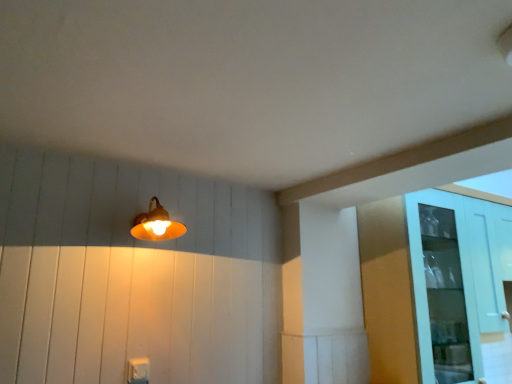
In order to face light blue glass cabinet at right, should I rotate leftwards or rightwards?

Turn right by 30.168 degrees to look at light blue glass cabinet at right.

What do you see at coordinates (443, 289) in the screenshot? The height and width of the screenshot is (384, 512). I see `light blue glass cabinet at right` at bounding box center [443, 289].

You are a GUI agent. You are given a task and a screenshot of the screen. Output one action in this format:
    pyautogui.click(x=<x>, y=<y>)
    Task: Click on the light blue glass cabinet at right
    
    Given the screenshot: What is the action you would take?
    pyautogui.click(x=443, y=289)

What is the approximate width of matte orange lampshade at upper left?

The width of matte orange lampshade at upper left is 26.81 centimeters.

The image size is (512, 384). What do you see at coordinates (156, 224) in the screenshot?
I see `matte orange lampshade at upper left` at bounding box center [156, 224].

What is the approximate height of matte orange lampshade at upper left?

6.95 inches.

Locate an element on the screen. Image resolution: width=512 pixels, height=384 pixels. matte orange lampshade at upper left is located at coordinates (156, 224).

This screenshot has height=384, width=512. What are the coordinates of `light blue glass cabinet at right` in the screenshot? It's located at (443, 289).

Is matte orange lampshade at upper left at the left side of light blue glass cabinet at right?

Correct, you'll find matte orange lampshade at upper left to the left of light blue glass cabinet at right.

Which object is closer to the camera, matte orange lampshade at upper left or light blue glass cabinet at right?

matte orange lampshade at upper left.

Considering the positions of point (172, 226) and point (415, 230), is point (172, 226) closer or farther from the camera than point (415, 230)?

Point (172, 226) is closer to the camera than point (415, 230).

From the image's perspective, is matte orange lampshade at upper left above or below light blue glass cabinet at right?

matte orange lampshade at upper left is situated higher than light blue glass cabinet at right in the image.

From a real-world perspective, relative to light blue glass cabinet at right, is matte orange lampshade at upper left vertically above or below?

In terms of real-world spatial position, matte orange lampshade at upper left is above light blue glass cabinet at right.

Looking at this image, looking at their sizes, would you say matte orange lampshade at upper left is wider or thinner than light blue glass cabinet at right?

Clearly, matte orange lampshade at upper left has less width compared to light blue glass cabinet at right.

Who is taller, matte orange lampshade at upper left or light blue glass cabinet at right?

light blue glass cabinet at right is taller.

Is matte orange lampshade at upper left bigger than light blue glass cabinet at right?

Incorrect, matte orange lampshade at upper left is not larger than light blue glass cabinet at right.

Choose the correct answer: Is matte orange lampshade at upper left inside light blue glass cabinet at right or outside it?

matte orange lampshade at upper left is located beyond the bounds of light blue glass cabinet at right.

Is matte orange lampshade at upper left directly adjacent to light blue glass cabinet at right?

They are not placed beside each other.

Is matte orange lampshade at upper left facing towards light blue glass cabinet at right?

No, matte orange lampshade at upper left is not facing towards light blue glass cabinet at right.

How different are the orientations of matte orange lampshade at upper left and light blue glass cabinet at right in degrees?

The facing directions of matte orange lampshade at upper left and light blue glass cabinet at right are 8.42 degrees apart.

How far apart are matte orange lampshade at upper left and light blue glass cabinet at right?

They are 4.45 feet apart.

Where is `glass door located below the matte orange lampshade at upper left (from the image's perspective)`? The width and height of the screenshot is (512, 384). glass door located below the matte orange lampshade at upper left (from the image's perspective) is located at coordinates (443, 289).

Consider the image. Which is more to the left, light blue glass cabinet at right or matte orange lampshade at upper left?

From the viewer's perspective, matte orange lampshade at upper left appears more on the left side.

Does light blue glass cabinet at right lie behind matte orange lampshade at upper left?

→ Yes, light blue glass cabinet at right is further from the viewer.

Is point (478, 381) farther from camera compared to point (162, 215)?

Yes, it is.

From the image's perspective, which object appears higher, light blue glass cabinet at right or matte orange lampshade at upper left?

matte orange lampshade at upper left appears higher in the image.

From a real-world perspective, relative to matte orange lampshade at upper left, is light blue glass cabinet at right vertically above or below?

light blue glass cabinet at right is situated lower than matte orange lampshade at upper left in the real world.

Considering the relative sizes of light blue glass cabinet at right and matte orange lampshade at upper left in the image provided, is light blue glass cabinet at right wider than matte orange lampshade at upper left?

Correct, the width of light blue glass cabinet at right exceeds that of matte orange lampshade at upper left.

Which of these two, light blue glass cabinet at right or matte orange lampshade at upper left, stands taller?

light blue glass cabinet at right is taller.

Does light blue glass cabinet at right have a smaller size compared to matte orange lampshade at upper left?

No.

Is light blue glass cabinet at right inside the boundaries of matte orange lampshade at upper left, or outside?

light blue glass cabinet at right is located beyond the bounds of matte orange lampshade at upper left.

Is light blue glass cabinet at right far from matte orange lampshade at upper left?

That's right, there is a large distance between light blue glass cabinet at right and matte orange lampshade at upper left.

Is light blue glass cabinet at right aimed at matte orange lampshade at upper left?

No, light blue glass cabinet at right does not turn towards matte orange lampshade at upper left.

You are a GUI agent. You are given a task and a screenshot of the screen. Output one action in this format:
    pyautogui.click(x=<x>, y=<y>)
    Task: Click on the glass door below the matte orange lampshade at upper left (from a real-world perspective)
    
    Given the screenshot: What is the action you would take?
    pyautogui.click(x=443, y=289)

Where is `lamp that is in front of the light blue glass cabinet at right`? Image resolution: width=512 pixels, height=384 pixels. lamp that is in front of the light blue glass cabinet at right is located at coordinates (156, 224).

I want to click on lamp lying on the left of light blue glass cabinet at right, so click(x=156, y=224).